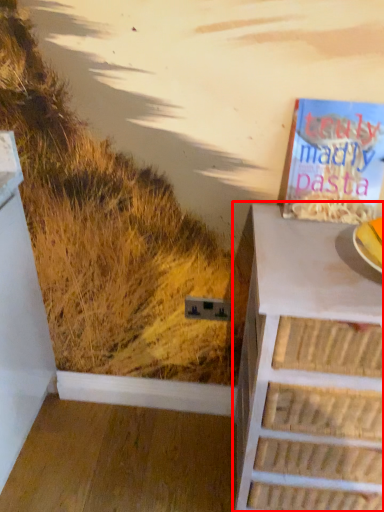
Question: Where is chest of drawers (annotated by the red box) located in relation to book in the image?

Choices:
 (A) right
 (B) left

Answer: (A)